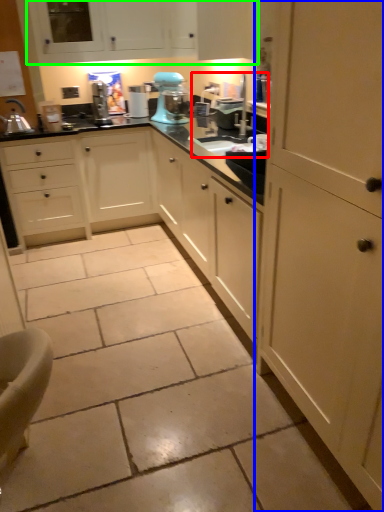
Question: Based on their relative distances, which object is nearer to sink (highlighted by a red box)? Choose from cabinetry (highlighted by a blue box) and cabinetry (highlighted by a green box).

Choices:
 (A) cabinetry
 (B) cabinetry

Answer: (B)